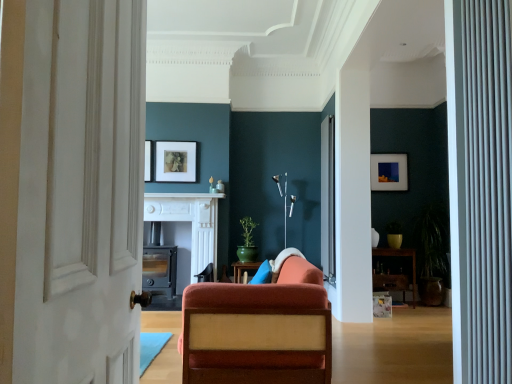
Question: Considering the relative sizes of white marble fireplace at center and white textured door at left in the image provided, is white marble fireplace at center thinner than white textured door at left?

Choices:
 (A) yes
 (B) no

Answer: (B)

Question: Is white marble fireplace at center positioned far away from white textured door at left?

Choices:
 (A) yes
 (B) no

Answer: (A)

Question: Is white textured door at left at the back of white marble fireplace at center?

Choices:
 (A) yes
 (B) no

Answer: (B)

Question: Can you confirm if white marble fireplace at center is smaller than white textured door at left?

Choices:
 (A) yes
 (B) no

Answer: (A)

Question: Is the depth of white marble fireplace at center less than that of white textured door at left?

Choices:
 (A) yes
 (B) no

Answer: (B)

Question: From a real-world perspective, is white marble fireplace at center physically located above or below white textured curtain at right?

Choices:
 (A) below
 (B) above

Answer: (B)

Question: In the image, is white marble fireplace at center on the left side or the right side of white textured curtain at right?

Choices:
 (A) right
 (B) left

Answer: (B)

Question: From the image's perspective, is white marble fireplace at center above or below white textured curtain at right?

Choices:
 (A) above
 (B) below

Answer: (B)

Question: Is white marble fireplace at center inside or outside of white textured curtain at right?

Choices:
 (A) outside
 (B) inside

Answer: (A)

Question: Is point (400, 251) closer or farther from the camera than point (508, 168)?

Choices:
 (A) closer
 (B) farther

Answer: (B)

Question: From the image's perspective, is wooden shelf at right positioned above or below white textured curtain at right?

Choices:
 (A) above
 (B) below

Answer: (B)

Question: From a real-world perspective, is wooden shelf at right positioned above or below white textured curtain at right?

Choices:
 (A) below
 (B) above

Answer: (A)

Question: Considering the positions of wooden shelf at right and white textured curtain at right in the image, is wooden shelf at right bigger or smaller than white textured curtain at right?

Choices:
 (A) small
 (B) big

Answer: (B)

Question: From the image's perspective, relative to velvet orange chair at center, is wooden shelf at right above or below?

Choices:
 (A) above
 (B) below

Answer: (B)

Question: From a real-world perspective, is wooden shelf at right positioned above or below velvet orange chair at center?

Choices:
 (A) above
 (B) below

Answer: (B)